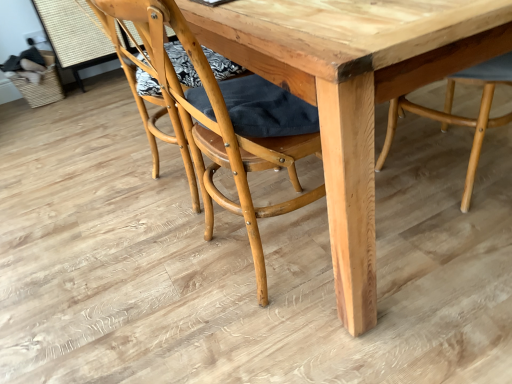
Locate an element on the screen. This screenshot has width=512, height=384. vacant space underneath natural wood chair at center, the first chair when ordered from left to right (from a real-world perspective) is located at coordinates (234, 259).